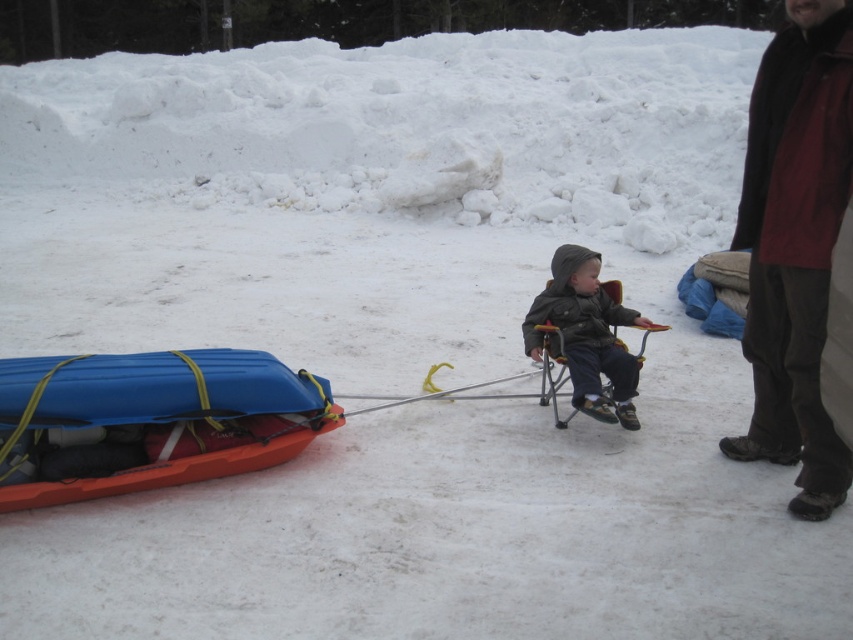
Is point (248, 394) more distant than point (596, 275)?

No, (248, 394) is in front of (596, 275).

You are a GUI agent. You are given a task and a screenshot of the screen. Output one action in this format:
    pyautogui.click(x=<x>, y=<y>)
    Task: Click on the blue plastic kayak at lower left
    
    Given the screenshot: What is the action you would take?
    pyautogui.click(x=149, y=420)

Who is taller, dark brown leather jacket at right or blue plastic kayak at lower left?

Standing taller between the two is dark brown leather jacket at right.

Does dark brown leather jacket at right appear over blue plastic kayak at lower left?

Yes.

Is point (787, 100) behind point (270, 465)?

No, (787, 100) is in front of (270, 465).

You are a GUI agent. You are given a task and a screenshot of the screen. Output one action in this format:
    pyautogui.click(x=<x>, y=<y>)
    Task: Click on the dark brown leather jacket at right
    
    Given the screenshot: What is the action you would take?
    pyautogui.click(x=795, y=244)

Can you confirm if dark brown leather jacket at right is positioned above dark gray fabric jacket at center?

Indeed, dark brown leather jacket at right is positioned over dark gray fabric jacket at center.

Who is shorter, dark brown leather jacket at right or dark gray fabric jacket at center?

Standing shorter between the two is dark gray fabric jacket at center.

In order to click on dark brown leather jacket at right in this screenshot , I will do `click(795, 244)`.

I want to click on dark brown leather jacket at right, so click(795, 244).